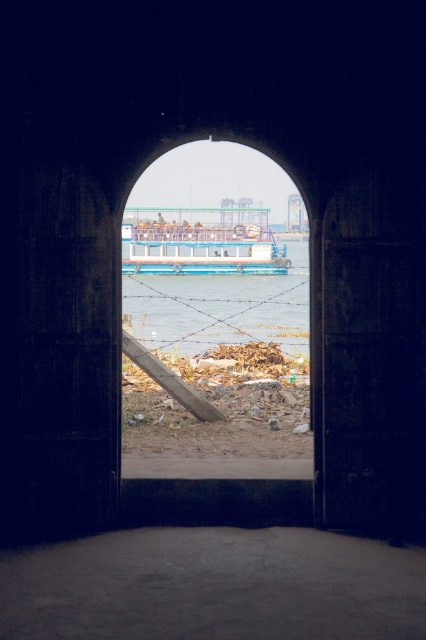
You are standing in front of the arched doorway and want to see the clear water at center. Where should you look relative to the doorway?

The clear water at center is located at the point with coordinates (216, 310), so you should look directly at the center of the doorway to see it.